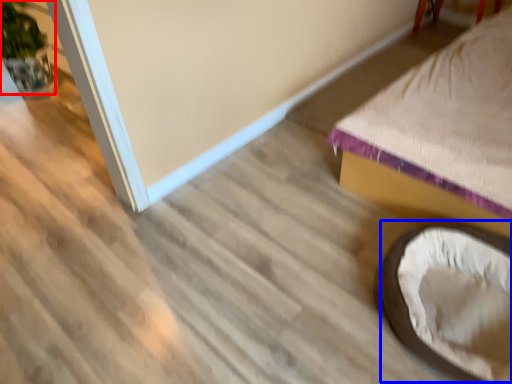
Question: Among these objects, which one is farthest to the camera, plant (highlighted by a red box) or bean bag chair (highlighted by a blue box)?

Choices:
 (A) plant
 (B) bean bag chair

Answer: (A)